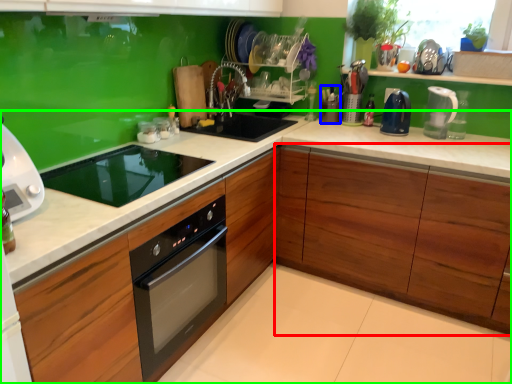
Question: Based on their relative distances, which object is farther from cabinetry (highlighted by a red box)? Choose from appliance (highlighted by a blue box) and countertop (highlighted by a green box).

Choices:
 (A) appliance
 (B) countertop

Answer: (A)